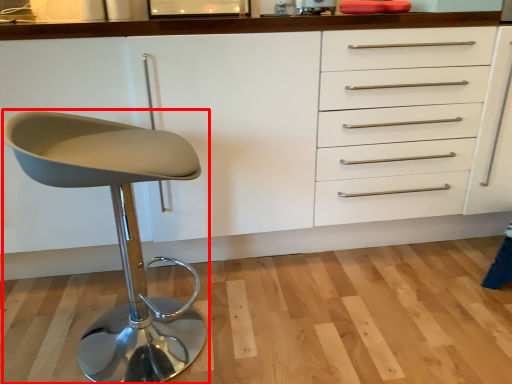
Question: From the image, what is the correct spatial relationship of chair (annotated by the red box) in relation to cabinetry?

Choices:
 (A) right
 (B) left

Answer: (B)